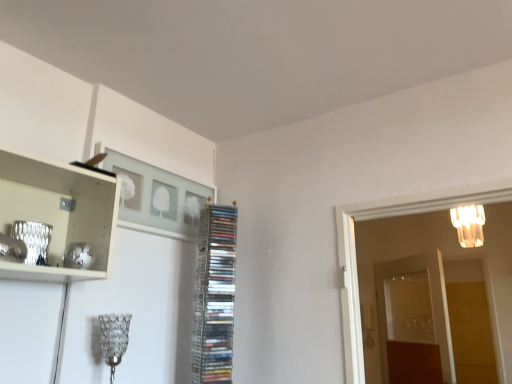
In order to face clear plastic rack of cds at center, should I rotate leftwards or rightwards?

It's best to rotate left around 5.104 degrees.

Describe the element at coordinates (156, 197) in the screenshot. I see `matte gray picture frame at upper center` at that location.

Describe the element at coordinates (409, 330) in the screenshot. The height and width of the screenshot is (384, 512). I see `transparent glass door at right, which is the 1th glass door from left to right` at that location.

Where is `translucent glass chandelier at upper right, arranged as the first lamp when viewed from the right`? Image resolution: width=512 pixels, height=384 pixels. translucent glass chandelier at upper right, arranged as the first lamp when viewed from the right is located at coordinates (469, 225).

Considering the points (499, 356) and (219, 339), which point is behind, point (499, 356) or point (219, 339)?

The point (499, 356) is behind.

Does transparent glass door at right, marked as the second glass door in a left-to-right arrangement, turn towards clear plastic rack of cds at center?

Yes.

Is transparent glass door at right, placed as the first glass door when sorted from right to left, inside or outside of clear plastic rack of cds at center?

transparent glass door at right, placed as the first glass door when sorted from right to left, lies outside clear plastic rack of cds at center.

Which is in front, transparent glass door at right, placed as the first glass door when sorted from right to left, or clear plastic rack of cds at center?

clear plastic rack of cds at center is in front.

From the picture: Considering the relative sizes of translucent glass chandelier at upper right, the 1th lamp from the back, and clear plastic rack of cds at center in the image provided, is translucent glass chandelier at upper right, the 1th lamp from the back, taller than clear plastic rack of cds at center?

No.

How much distance is there between translucent glass chandelier at upper right, which ranks as the second lamp in front-to-back order, and clear plastic rack of cds at center?

A distance of 1.53 meters exists between translucent glass chandelier at upper right, which ranks as the second lamp in front-to-back order, and clear plastic rack of cds at center.

Choose the correct answer: Is translucent glass chandelier at upper right, the 1th lamp from the back, inside clear plastic rack of cds at center or outside it?

translucent glass chandelier at upper right, the 1th lamp from the back, exists outside the volume of clear plastic rack of cds at center.

In the image, is translucent glass chandelier at upper right, acting as the first lamp starting from the top, positioned in front of or behind matte gray picture frame at upper center?

translucent glass chandelier at upper right, acting as the first lamp starting from the top, is behind matte gray picture frame at upper center.

Who is bigger, translucent glass chandelier at upper right, acting as the first lamp starting from the top, or matte gray picture frame at upper center?

Bigger between the two is matte gray picture frame at upper center.

Which object is positioned more to the right, translucent glass chandelier at upper right, which is the second lamp in left-to-right order, or matte gray picture frame at upper center?

translucent glass chandelier at upper right, which is the second lamp in left-to-right order.

Could matte gray picture frame at upper center be considered to be inside translucent glass chandelier at upper right, which ranks as the 2th lamp in bottom-to-top order?

No, matte gray picture frame at upper center is not a part of translucent glass chandelier at upper right, which ranks as the 2th lamp in bottom-to-top order.

Considering the relative positions of transparent glass door at right, acting as the 2th glass door starting from the right, and matte gray picture frame at upper center in the image provided, is transparent glass door at right, acting as the 2th glass door starting from the right, to the left of matte gray picture frame at upper center from the viewer's perspective?

No.

Is transparent glass door at right, which is the 1th glass door from left to right, inside or outside of matte gray picture frame at upper center?

The correct answer is: outside.

From the picture: Which object is wider, transparent glass door at right, acting as the 2th glass door starting from the right, or matte gray picture frame at upper center?

With larger width is transparent glass door at right, acting as the 2th glass door starting from the right.

Which of these two, transparent glass door at right, which is the 1th glass door from left to right, or matte gray picture frame at upper center, is bigger?

transparent glass door at right, which is the 1th glass door from left to right, is bigger.

Between point (192, 239) and point (101, 316), which one is positioned behind?

The point (192, 239) is farther.

The width and height of the screenshot is (512, 384). What are the coordinates of `picture frame located above the clear glass lampshade at lower left, which is the first lamp in left-to-right order (from the image's perspective)` in the screenshot? It's located at (156, 197).

Is matte gray picture frame at upper center taller than clear glass lampshade at lower left, which is counted as the 2th lamp, starting from the right?

In fact, matte gray picture frame at upper center may be shorter than clear glass lampshade at lower left, which is counted as the 2th lamp, starting from the right.

In the scene shown: Is clear glass lampshade at lower left, the first lamp when ordered from front to back, surrounded by matte gray picture frame at upper center?

No, matte gray picture frame at upper center does not contain clear glass lampshade at lower left, the first lamp when ordered from front to back.

Considering the sizes of objects matte gray picture frame at upper center and translucent glass chandelier at upper right, which ranks as the 2th lamp in bottom-to-top order, in the image provided, who is bigger, matte gray picture frame at upper center or translucent glass chandelier at upper right, which ranks as the 2th lamp in bottom-to-top order,?

With larger size is matte gray picture frame at upper center.

Between matte gray picture frame at upper center and translucent glass chandelier at upper right, acting as the first lamp starting from the top, which one has larger width?

With larger width is translucent glass chandelier at upper right, acting as the first lamp starting from the top.

Is transparent glass door at right, placed as the first glass door when sorted from right to left, smaller than translucent glass chandelier at upper right, the 1th lamp from the back?

No, transparent glass door at right, placed as the first glass door when sorted from right to left, is not smaller than translucent glass chandelier at upper right, the 1th lamp from the back.

Is transparent glass door at right, marked as the second glass door in a left-to-right arrangement, to the right of translucent glass chandelier at upper right, which is the second lamp in left-to-right order, from the viewer's perspective?

Correct, you'll find transparent glass door at right, marked as the second glass door in a left-to-right arrangement, to the right of translucent glass chandelier at upper right, which is the second lamp in left-to-right order.

From the image's perspective, is transparent glass door at right, placed as the first glass door when sorted from right to left, positioned above or below translucent glass chandelier at upper right, the 1th lamp from the back?

From the image's perspective, transparent glass door at right, placed as the first glass door when sorted from right to left, appears below translucent glass chandelier at upper right, the 1th lamp from the back.

Are transparent glass door at right, marked as the second glass door in a left-to-right arrangement, and translucent glass chandelier at upper right, acting as the first lamp starting from the top, far apart?

Absolutely, transparent glass door at right, marked as the second glass door in a left-to-right arrangement, is distant from translucent glass chandelier at upper right, acting as the first lamp starting from the top.

There is a clear plastic rack of cds at center. At what (x,y) coordinates should I click in order to perform the action: click on the 2nd glass door below it (from the image's perspective). Please return your answer as a coordinate pair (x, y). This screenshot has height=384, width=512. Looking at the image, I should click on (355, 253).

Locate an element on the screen. cabinet on the left of the translucent glass chandelier at upper right, which ranks as the second lamp in front-to-back order is located at coordinates (214, 296).

Looking at the image, which one is located further to translucent glass chandelier at upper right, which is the second lamp in left-to-right order, transparent glass door at right, placed as the first glass door when sorted from right to left, or clear plastic rack of cds at center?

Based on the image, clear plastic rack of cds at center appears to be further to translucent glass chandelier at upper right, which is the second lamp in left-to-right order.

Based on their spatial positions, is transparent glass door at right, placed as the first glass door when sorted from right to left, or translucent glass chandelier at upper right, the 1th lamp from the back, further from clear glass lampshade at lower left, the first lamp when ordered from front to back?

translucent glass chandelier at upper right, the 1th lamp from the back.

Estimate the real-world distances between objects in this image. Which object is closer to transparent glass door at right, which is the 1th glass door from left to right, clear plastic rack of cds at center or translucent glass chandelier at upper right, acting as the first lamp starting from the top?

translucent glass chandelier at upper right, acting as the first lamp starting from the top, is closer to transparent glass door at right, which is the 1th glass door from left to right.

From the image, which object appears to be nearer to transparent glass door at right, which is the 1th glass door from left to right, transparent glass door at right, marked as the second glass door in a left-to-right arrangement, or clear plastic rack of cds at center?

transparent glass door at right, marked as the second glass door in a left-to-right arrangement, is positioned closer to the anchor transparent glass door at right, which is the 1th glass door from left to right.

From the image, which object appears to be nearer to clear plastic rack of cds at center, matte gray picture frame at upper center or clear glass lampshade at lower left, the first lamp when ordered from front to back?

Based on the image, matte gray picture frame at upper center appears to be nearer to clear plastic rack of cds at center.

When comparing their distances from clear plastic rack of cds at center, does translucent glass chandelier at upper right, the 1th lamp from the back, or transparent glass door at right, which is the 1th glass door from left to right, seem further?

transparent glass door at right, which is the 1th glass door from left to right, is positioned further to the anchor clear plastic rack of cds at center.

Considering their positions, is matte gray picture frame at upper center positioned further to clear plastic rack of cds at center than transparent glass door at right, marked as the second glass door in a left-to-right arrangement?

transparent glass door at right, marked as the second glass door in a left-to-right arrangement, is further to clear plastic rack of cds at center.

Estimate the real-world distances between objects in this image. Which object is closer to transparent glass door at right, which is the 1th glass door from left to right, clear plastic rack of cds at center or clear glass lampshade at lower left, the second lamp when ordered from back to front?

clear plastic rack of cds at center is closer to transparent glass door at right, which is the 1th glass door from left to right.

You are a GUI agent. You are given a task and a screenshot of the screen. Output one action in this format:
    pyautogui.click(x=<x>, y=<y>)
    Task: Click on the picture frame located between clear glass lampshade at lower left, the second lamp when ordered from back to front, and transparent glass door at right, acting as the 2th glass door starting from the right, in the left-right direction
    
    Given the screenshot: What is the action you would take?
    pyautogui.click(x=156, y=197)

This screenshot has width=512, height=384. In order to click on lamp between clear plastic rack of cds at center and transparent glass door at right, placed as the first glass door when sorted from right to left, from left to right in this screenshot , I will do `click(469, 225)`.

Locate an element on the screen. glass door between translucent glass chandelier at upper right, which ranks as the second lamp in front-to-back order, and transparent glass door at right, placed as the first glass door when sorted from right to left, in the vertical direction is located at coordinates (409, 330).

Where is `cabinet between clear glass lampshade at lower left, which is counted as the 2th lamp, starting from the right, and transparent glass door at right, acting as the 2th glass door starting from the right`? The width and height of the screenshot is (512, 384). cabinet between clear glass lampshade at lower left, which is counted as the 2th lamp, starting from the right, and transparent glass door at right, acting as the 2th glass door starting from the right is located at coordinates (214, 296).